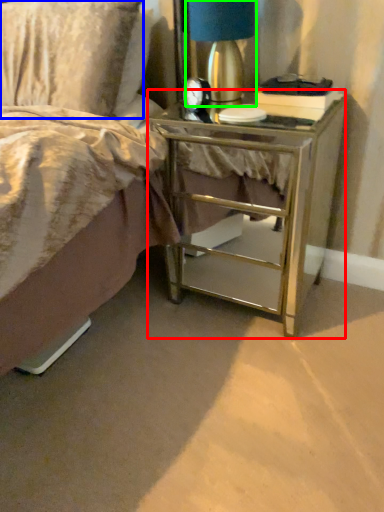
Question: Considering the real-world distances, which object is farthest from nightstand (highlighted by a red box)? pillow (highlighted by a blue box) or bedside lamp (highlighted by a green box)?

Choices:
 (A) pillow
 (B) bedside lamp

Answer: (A)